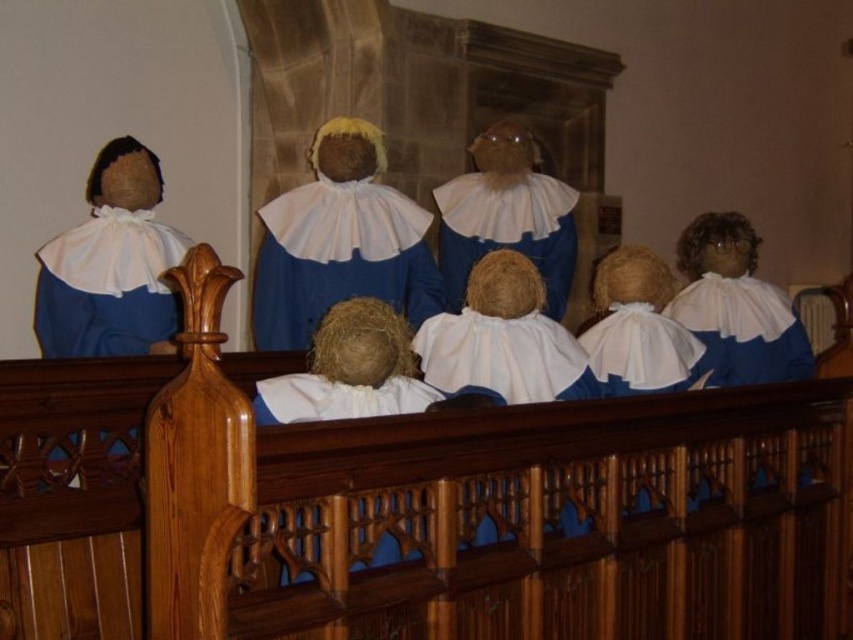
Question: Can you confirm if matte blue dress at center is smaller than white cotton doll at center?

Choices:
 (A) no
 (B) yes

Answer: (B)

Question: Which point is closer to the camera taking this photo?

Choices:
 (A) (291, 218)
 (B) (560, 262)

Answer: (A)

Question: Does matte blue dress at center come in front of white cotton doll at center?

Choices:
 (A) no
 (B) yes

Answer: (B)

Question: Does matte blue dress at center have a smaller size compared to white cotton doll at center?

Choices:
 (A) no
 (B) yes

Answer: (B)